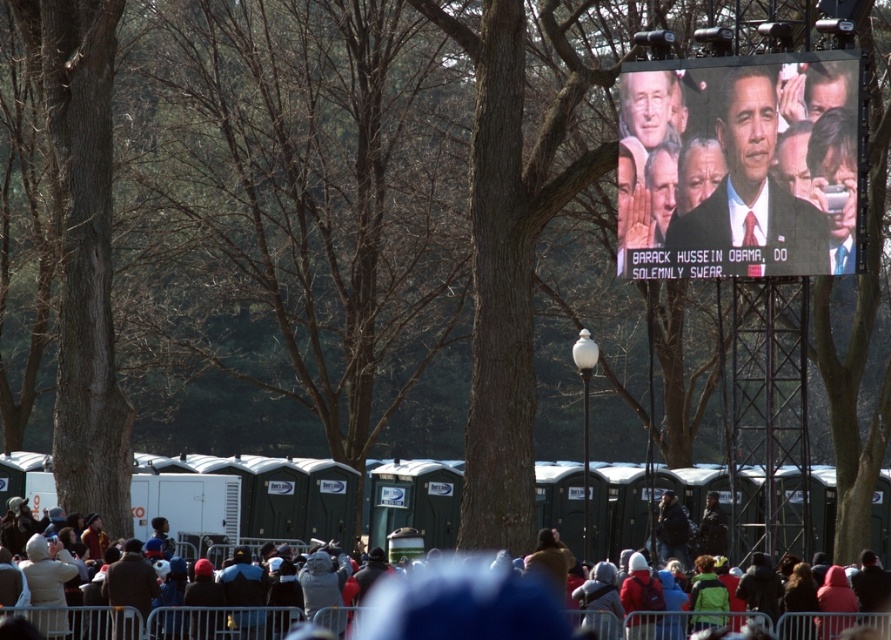
You are attending an event and want to take a photo of the matte black screen at upper center and the dark gray fabric crowd at lower center. Which object would appear larger in your photo?

The matte black screen at upper center would appear larger in the photo because it is bigger than the dark gray fabric crowd at lower center.

You are standing at the event and want to check the distance between yourself and the matte black screen at upper center. You have a measuring tape that can extend up to 100 meters. Can you safely measure the distance without needing to extend the tape beyond its limit?

The matte black screen at upper center and viewer are 84.51 meters apart from each other, so yes, the measuring tape can safely measure the distance since it is within the 100 meters limit.

You are a photographer at the event and want to capture a photo that includes both the matte black screen at upper center and the dark gray fabric crowd at lower center. However, you need to ensure the crowd is visible behind the screen. Can you position yourself in a way that allows both elements to be seen in the same frame?

Yes, since the dark gray fabric crowd at lower center is behind the matte black screen at upper center, positioning yourself so that the screen is in the foreground and the crowd is in the background will allow both to be visible in the photo.